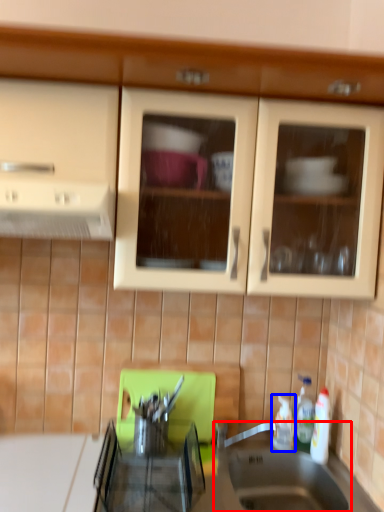
Question: Among these objects, which one is farthest to the camera, sink (highlighted by a red box) or bottle (highlighted by a blue box)?

Choices:
 (A) sink
 (B) bottle

Answer: (B)